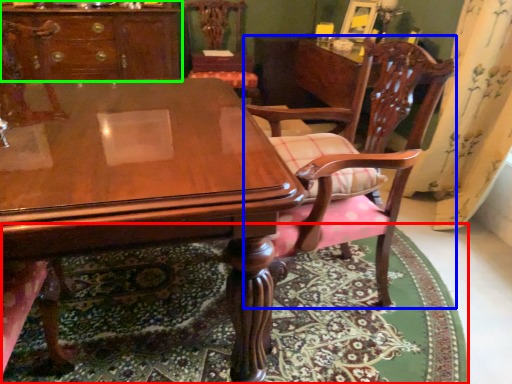
Question: Which object is positioned closest to mat (highlighted by a red box)? Select from chair (highlighted by a blue box) and cabinetry (highlighted by a green box).

Choices:
 (A) chair
 (B) cabinetry

Answer: (A)